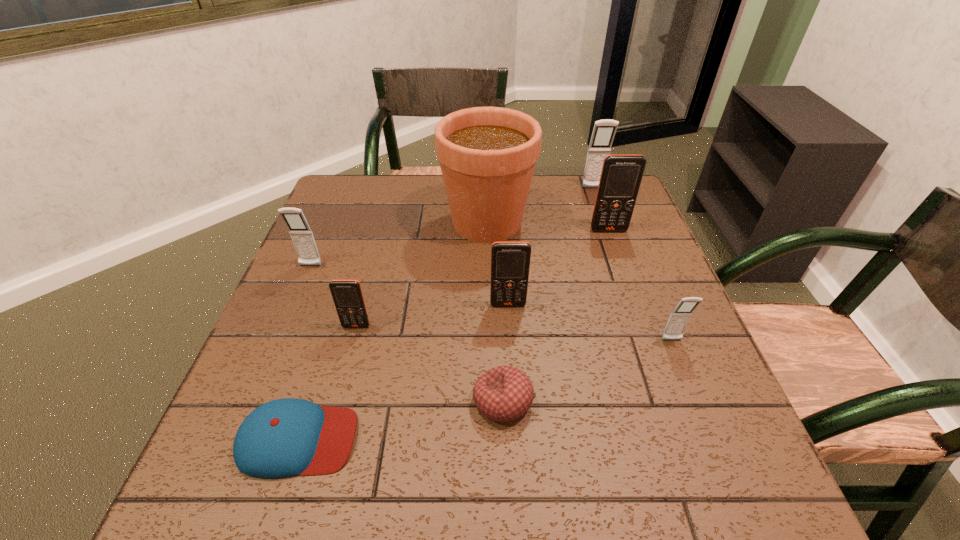
Identify the location of vacant space located 0.220m on the screen of the smallest orange cellular telephone. The width and height of the screenshot is (960, 540). (330, 423).

Where is `free region located on the front-facing side of the nearest cellular telephone`? This screenshot has height=540, width=960. free region located on the front-facing side of the nearest cellular telephone is located at coordinates (723, 467).

Locate an element on the screen. free space located on the right of the beanbag is located at coordinates (564, 401).

Find the location of a particular element. Image resolution: width=960 pixels, height=540 pixels. vacant space located with the bill of the baseball cap facing forward is located at coordinates (545, 439).

At what (x,y) coordinates should I click in order to perform the action: click on flowerpot that is at the far edge. Please return your answer as a coordinate pair (x, y). The height and width of the screenshot is (540, 960). Looking at the image, I should click on (487, 155).

Locate an element on the screen. This screenshot has height=540, width=960. cellular telephone that is at the far edge is located at coordinates (604, 131).

Find the location of `object that is positioned at the near edge`. object that is positioned at the near edge is located at coordinates (287, 437).

The height and width of the screenshot is (540, 960). In order to click on baseball cap present at the left edge in this screenshot , I will do `click(287, 437)`.

This screenshot has height=540, width=960. Identify the location of object present at the near left corner. (287, 437).

You are a GUI agent. You are given a task and a screenshot of the screen. Output one action in this format:
    pyautogui.click(x=<x>, y=<y>)
    Task: Click on the object that is at the far right corner
    This screenshot has width=960, height=540.
    Given the screenshot: What is the action you would take?
    pyautogui.click(x=604, y=131)